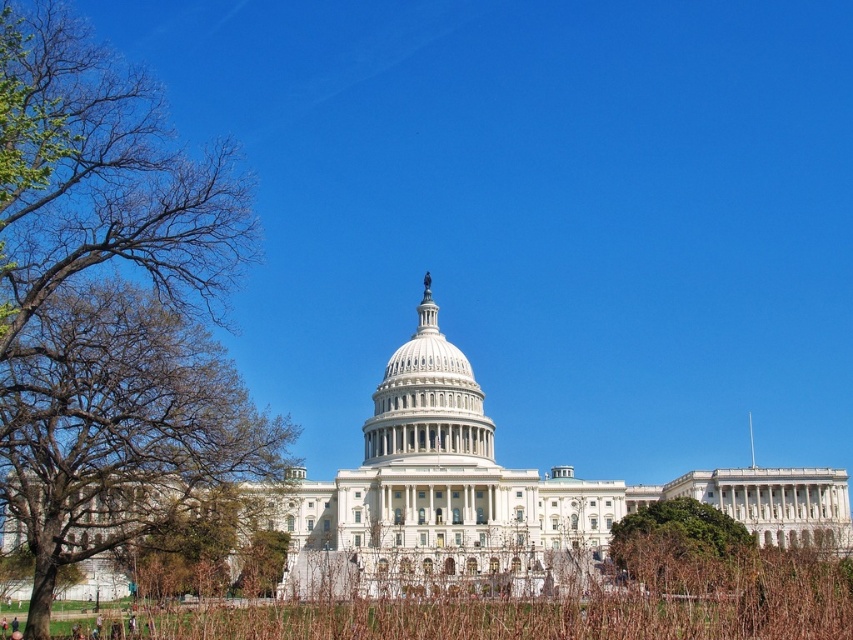
Question: Considering the relative positions of white marble dome at center and green leafy tree at lower right in the image provided, where is white marble dome at center located with respect to green leafy tree at lower right?

Choices:
 (A) left
 (B) right

Answer: (A)

Question: Is brown leafy tree at left further to the viewer compared to white marble dome at center?

Choices:
 (A) no
 (B) yes

Answer: (A)

Question: Which point is farther from the camera taking this photo?

Choices:
 (A) (744, 538)
 (B) (28, 35)
 (C) (405, 384)

Answer: (C)

Question: Which object appears farthest from the camera in this image?

Choices:
 (A) brown leafy tree at left
 (B) green leafy tree at lower right

Answer: (B)

Question: Which point is farther to the camera?

Choices:
 (A) (695, 508)
 (B) (247, 448)
 (C) (418, 369)

Answer: (C)

Question: Considering the relative positions of brown leafy tree at left and green leafy tree at lower right in the image provided, where is brown leafy tree at left located with respect to green leafy tree at lower right?

Choices:
 (A) above
 (B) below

Answer: (A)